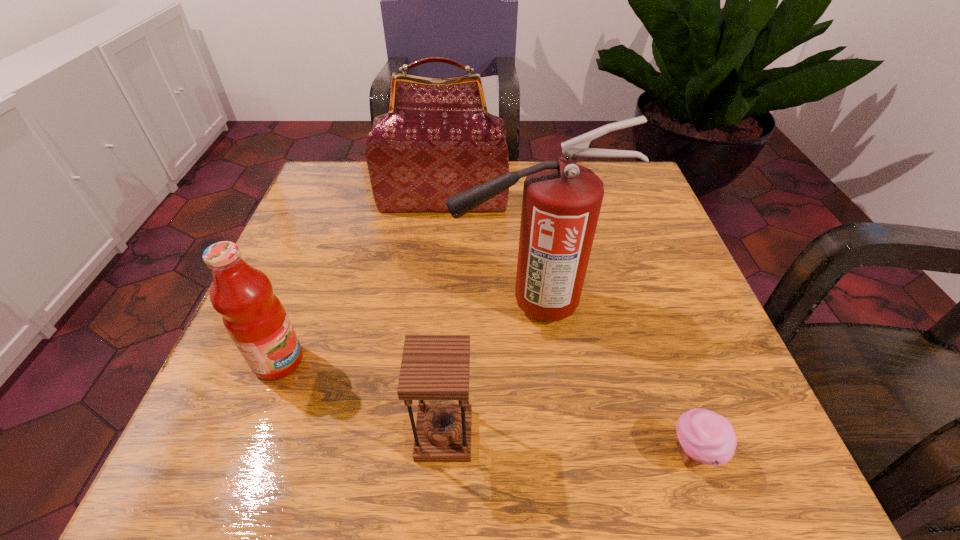
Find the location of a particular element. Image resolution: width=960 pixels, height=540 pixels. free spot that satisfies the following two spatial constraints: 1. on the front-facing side of the handbag; 2. on the front label of the leftmost object is located at coordinates pos(427,361).

This screenshot has height=540, width=960. What are the coordinates of `vacant position in the image that satisfies the following two spatial constraints: 1. on the front-facing side of the farthest object; 2. on the front label of the third shortest object` in the screenshot? It's located at (427, 361).

You are a GUI agent. You are given a task and a screenshot of the screen. Output one action in this format:
    pyautogui.click(x=<x>, y=<y>)
    Task: Click on the vacant space that satisfies the following two spatial constraints: 1. at the nozzle of the second farthest object; 2. on the left side of the cupcake
    The height and width of the screenshot is (540, 960).
    Given the screenshot: What is the action you would take?
    pyautogui.click(x=545, y=454)

Find the location of `vacant area that satisfies the following two spatial constraints: 1. on the front-facing side of the shortest object; 2. on the right side of the farthest object`. vacant area that satisfies the following two spatial constraints: 1. on the front-facing side of the shortest object; 2. on the right side of the farthest object is located at coordinates (419, 454).

Locate an element on the screen. free region that satisfies the following two spatial constraints: 1. on the front-facing side of the handbag; 2. on the left side of the hourglass is located at coordinates (420, 435).

At what (x,y) coordinates should I click in order to perform the action: click on vacant space that satisfies the following two spatial constraints: 1. on the front label of the leftmost object; 2. on the back side of the shortest object. Please return your answer as a coordinate pair (x, y). The image size is (960, 540). Looking at the image, I should click on click(x=243, y=454).

I want to click on free space that satisfies the following two spatial constraints: 1. on the back side of the shortest object; 2. at the nozzle of the second farthest object, so [641, 305].

At what (x,y) coordinates should I click in order to perform the action: click on free point that satisfies the following two spatial constraints: 1. on the front label of the leftmost object; 2. on the back side of the hourglass. Please return your answer as a coordinate pair (x, y). This screenshot has width=960, height=540. Looking at the image, I should click on (251, 435).

Locate an element on the screen. free space that satisfies the following two spatial constraints: 1. on the front label of the third farthest object; 2. on the back side of the fourth tallest object is located at coordinates (251, 435).